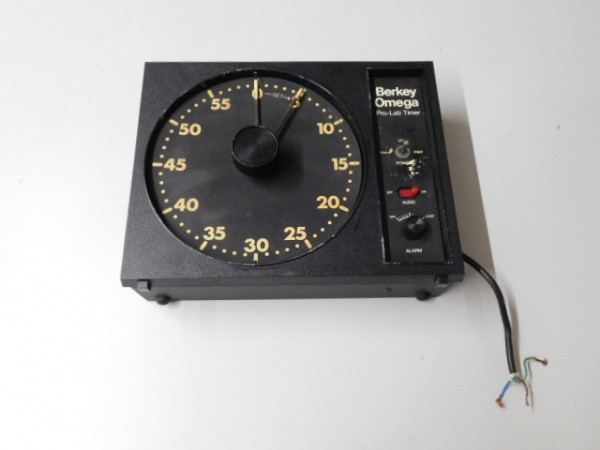
You are a GUI agent. You are given a task and a screenshot of the screen. Output one action in this format:
    pyautogui.click(x=<x>, y=<y>)
    Task: Click on the switch
    The image size is (600, 450).
    Given the screenshot: What is the action you would take?
    pyautogui.click(x=403, y=148)